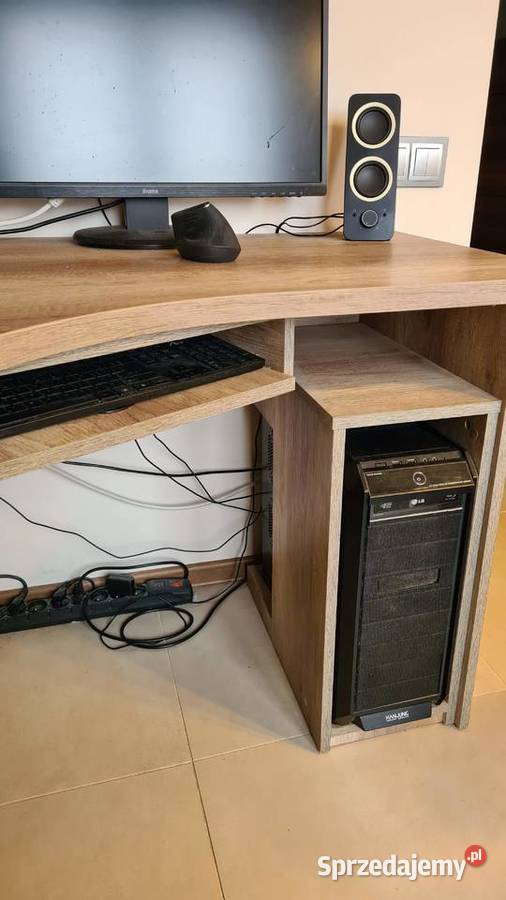
Identify the location of surge protector. (52, 618).